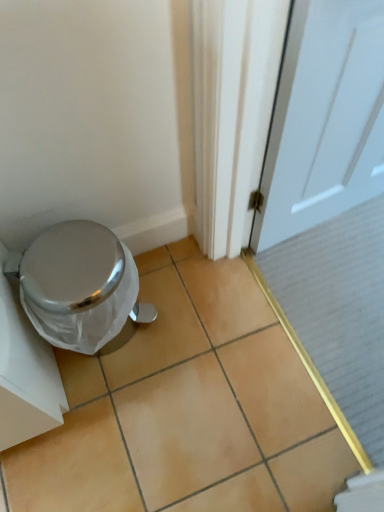
What is the approximate height of brushed metal trash can at lower left?

The height of brushed metal trash can at lower left is 13.81 inches.

The image size is (384, 512). What do you see at coordinates (78, 285) in the screenshot?
I see `brushed metal trash can at lower left` at bounding box center [78, 285].

Locate an element on the screen. brushed metal trash can at lower left is located at coordinates (78, 285).

Measure the distance between brushed metal trash can at lower left and camera.

The distance of brushed metal trash can at lower left from camera is 35.99 inches.

At what (x,y) coordinates should I click in order to perform the action: click on brushed metal trash can at lower left. Please return your answer as a coordinate pair (x, y). Looking at the image, I should click on (78, 285).